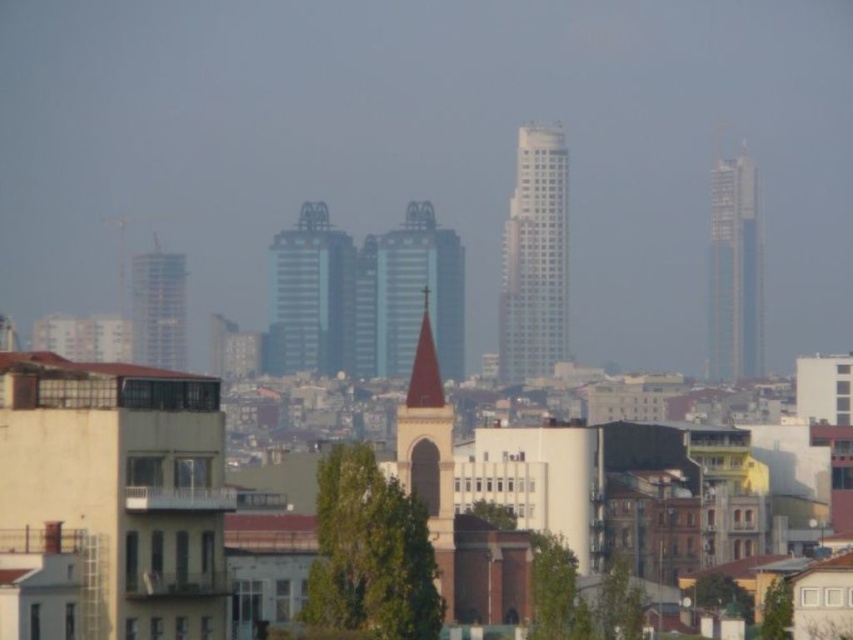
From the picture: Which is above, white glass tower at center or metallic glass tower at center?

white glass tower at center is higher up.

The height and width of the screenshot is (640, 853). I want to click on white glass tower at center, so click(x=534, y=259).

Between sleek glass skyscraper at center and smooth glass skyscraper at right, which one is positioned lower?

Positioned lower is sleek glass skyscraper at center.

Which is more to the right, sleek glass skyscraper at center or smooth glass skyscraper at right?

Positioned to the right is smooth glass skyscraper at right.

The width and height of the screenshot is (853, 640). What are the coordinates of `sleek glass skyscraper at center` in the screenshot? It's located at (311, 296).

Locate an element on the screen. sleek glass skyscraper at center is located at coordinates (311, 296).

Is point (503, 308) positioned before point (305, 310)?

Yes.

Can you confirm if white glass tower at center is wider than sleek glass skyscraper at center?

In fact, white glass tower at center might be narrower than sleek glass skyscraper at center.

The image size is (853, 640). Identify the location of white glass tower at center. (534, 259).